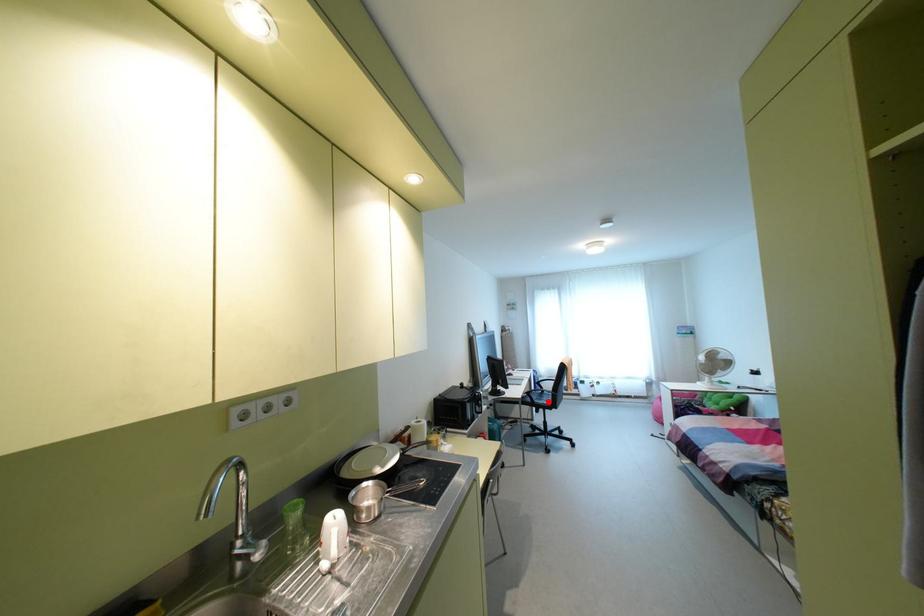
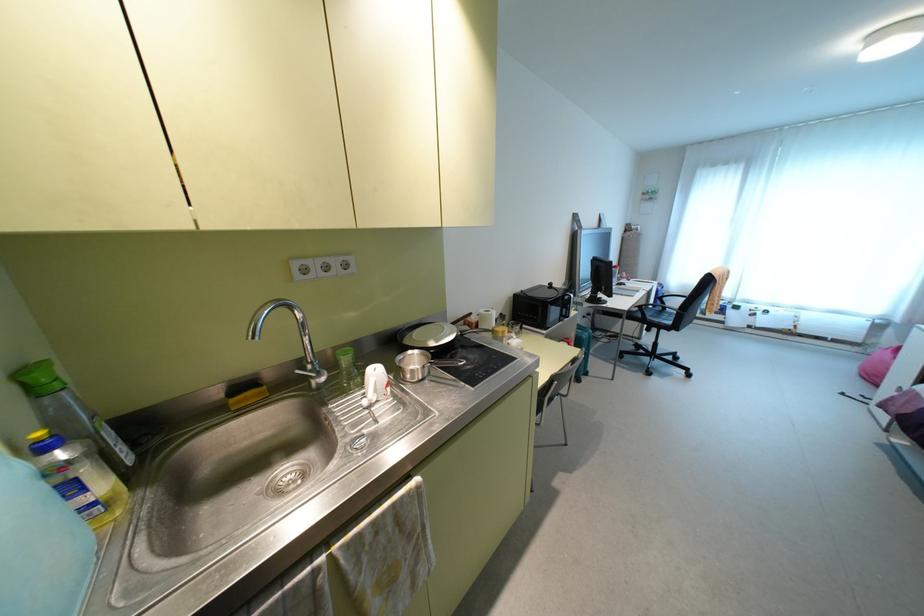
The point at the highlighted location is marked in the first image. Where is the corresponding point in the second image?

(667, 322)